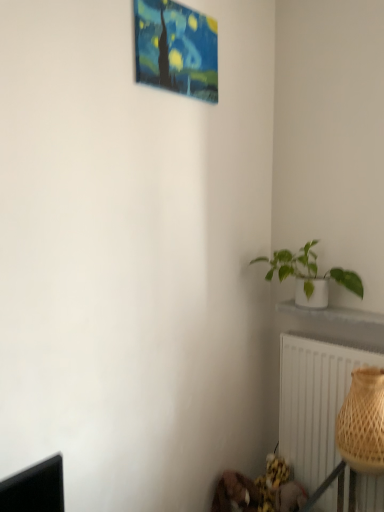
Question: Would you say brown woven basket at lower right is inside or outside white ceramic plant pot at lower right?

Choices:
 (A) inside
 (B) outside

Answer: (B)

Question: Is brown woven basket at lower right to the left or to the right of white ceramic plant pot at lower right in the image?

Choices:
 (A) right
 (B) left

Answer: (A)

Question: Based on their relative distances, which object is farther from the painted canvas painting at upper center?

Choices:
 (A) white textured radiator at lower right
 (B) brown woven basket at lower right
 (C) white ceramic plant pot at lower right
 (D) white matte pot at right

Answer: (A)

Question: Based on their relative distances, which object is nearer to the brown woven basket at lower right?

Choices:
 (A) painted canvas painting at upper center
 (B) white matte pot at right
 (C) white ceramic plant pot at lower right
 (D) white textured radiator at lower right

Answer: (D)